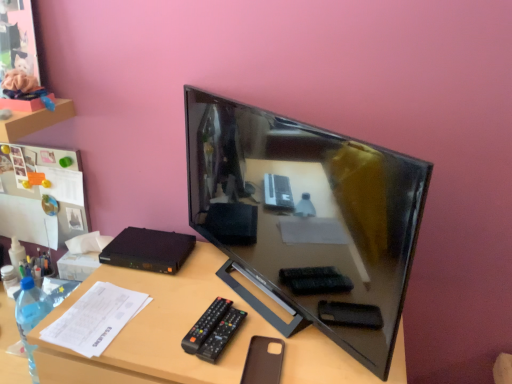
Identify the location of free space that is in between black plastic remote at lower center and white paper at lower left. This screenshot has height=384, width=512. pyautogui.click(x=159, y=326).